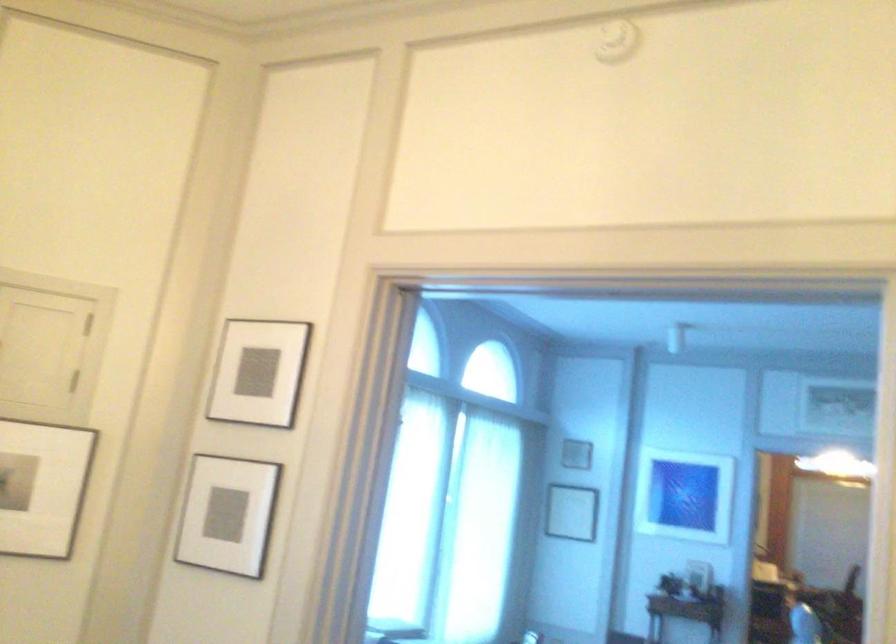
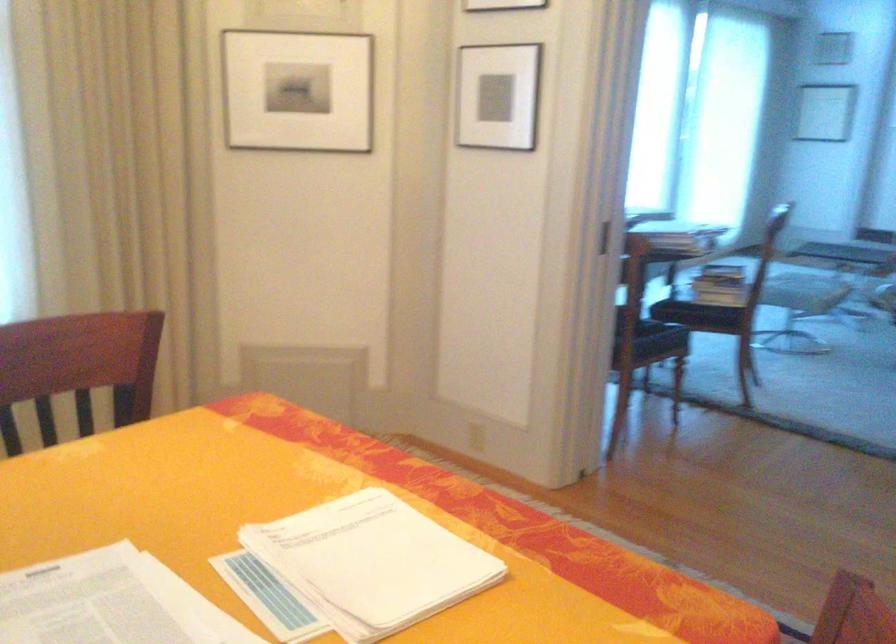
How did the camera likely rotate?

The rotation direction of the camera is left-down.